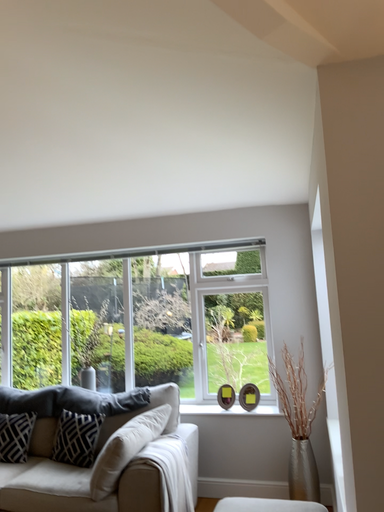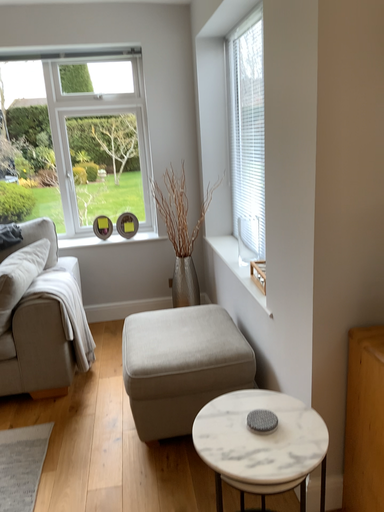
Question: How did the camera likely rotate when shooting the video?

Choices:
 (A) rotated downward
 (B) rotated upward

Answer: (A)